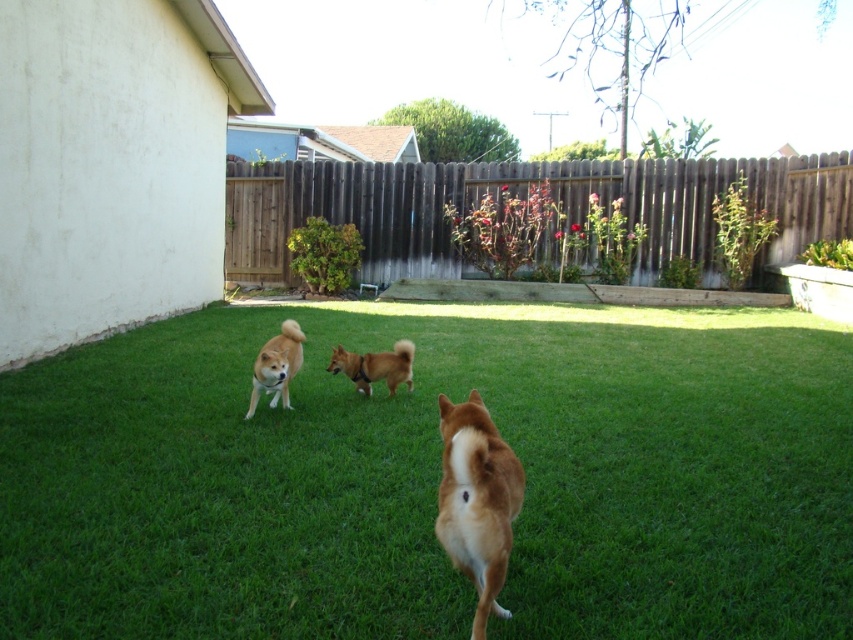
You are standing at the center of the backyard and see the point marked at coordinates (433, 477). What is located at that point?

The point at (433, 477) is occupied by green grass at center.

You are standing at the camera position and want to throw a ball to a specific point in the backyard. The point you want to reach is labeled as point (254, 372). Considering the distance between you and this point, can you estimate whether the throw will require a short toss or a long throw?

The distance between the camera and point (254, 372) is 5.56 meters. A throw of this distance would require a long toss.